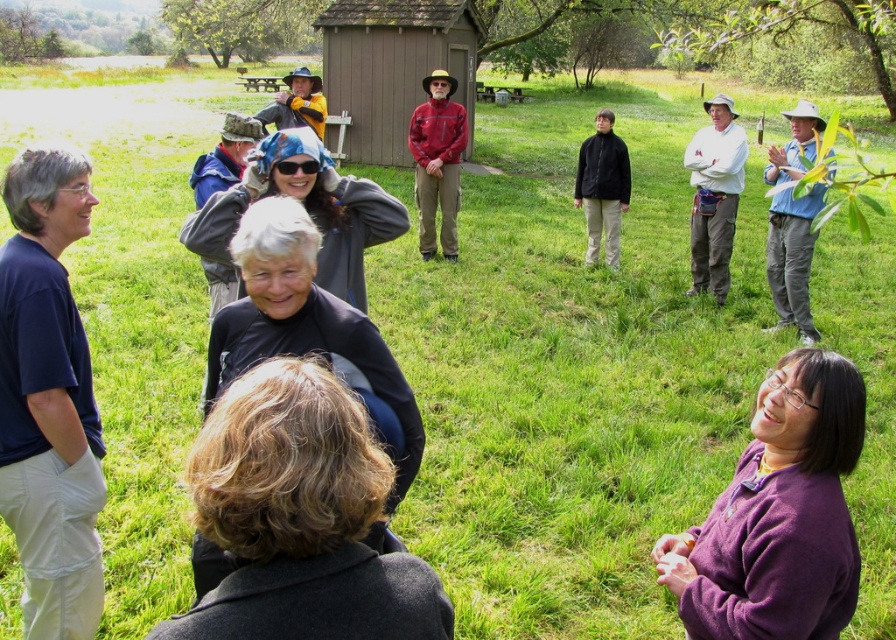
You are a photographer trying to capture a group photo of the dark brown hair at lower center and the blue fabric shirt at right. Since you want to ensure both subjects are clearly visible, which subject should you focus on first based on their height?

The dark brown hair at lower center is shorter than the blue fabric shirt at right, so you should focus on the blue fabric shirt at right first because it is taller and will be more prominent in the frame.

You are a photographer trying to capture a group photo of the dark brown hair at lower center and the blue fabric shirt at right. Based on their positions, which person should you focus on first to ensure both are in frame?

The dark brown hair at lower center is below the blue fabric shirt at right, so you should focus on the blue fabric shirt at right first to ensure both are in frame.

You are a photographer trying to capture a group photo of the dark brown hair at lower center and the blue fabric shirt at right. Which of the two has a narrower width in the image?

The dark brown hair at lower center is thinner than the blue fabric shirt at right, so the dark brown hair at lower center has a narrower width in the image.